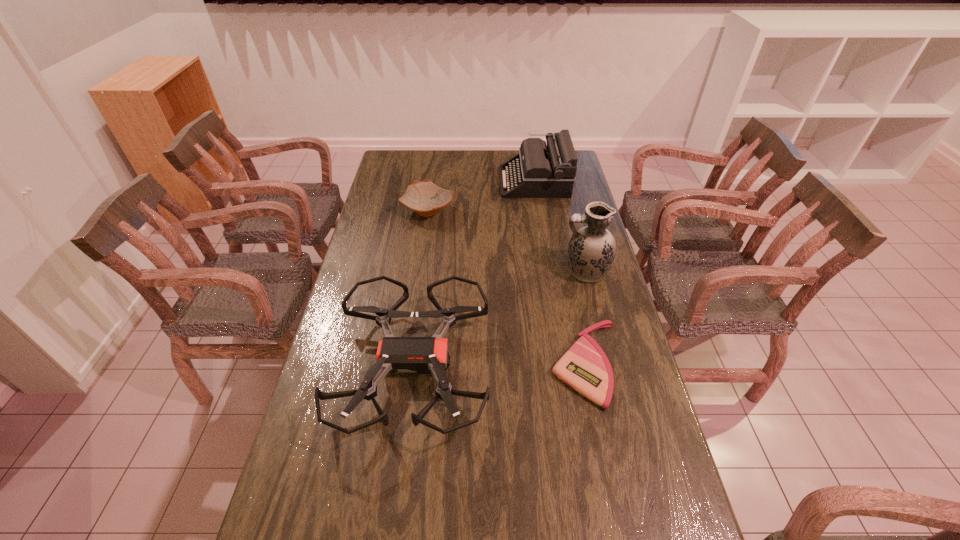
This screenshot has height=540, width=960. Find the location of `wristlet that is at the right edge`. wristlet that is at the right edge is located at coordinates (585, 367).

Where is `object located in the far right corner section of the desktop`? Image resolution: width=960 pixels, height=540 pixels. object located in the far right corner section of the desktop is located at coordinates (539, 171).

The image size is (960, 540). I want to click on vacant area at the far edge, so click(x=498, y=167).

The image size is (960, 540). Find the location of `vacant area at the left edge of the desktop`. vacant area at the left edge of the desktop is located at coordinates [392, 243].

Where is `vacant space at the right edge of the desktop`? This screenshot has height=540, width=960. vacant space at the right edge of the desktop is located at coordinates (586, 207).

This screenshot has width=960, height=540. In the image, there is a desktop. What are the coordinates of `vacant space at the far left corner` in the screenshot? It's located at (401, 172).

This screenshot has width=960, height=540. Find the location of `free space between the shortest object and the tallest object`. free space between the shortest object and the tallest object is located at coordinates (586, 318).

Image resolution: width=960 pixels, height=540 pixels. I want to click on free area in between the third farthest object and the shortest object, so click(x=586, y=318).

You are a GUI agent. You are given a task and a screenshot of the screen. Output one action in this format:
    pyautogui.click(x=<x>, y=<y>)
    Task: Click on the vacant point located between the typewriter and the second shortest object
    
    Given the screenshot: What is the action you would take?
    481,196

Where is `unoccupied area between the drone and the second shortest object`? unoccupied area between the drone and the second shortest object is located at coordinates (420, 288).